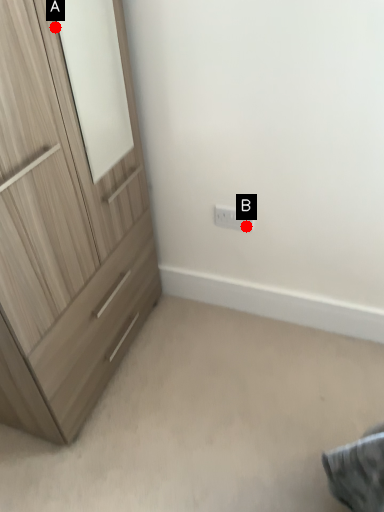
Question: Two points are circled on the image, labeled by A and B beside each circle. Which of the following is the farthest from the observer?

Choices:
 (A) A is further
 (B) B is further

Answer: (B)